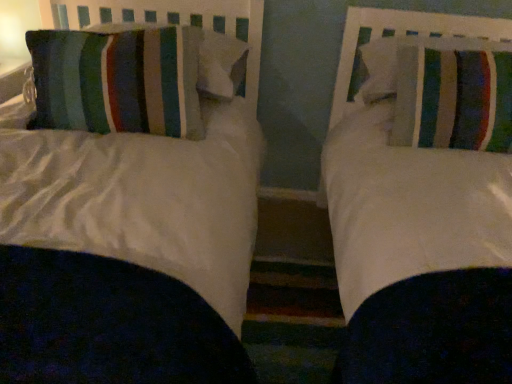
Question: From a real-world perspective, is striped fabric pillow at left, the fourth pillow when ordered from right to left, physically above striped fabric pillow at right, marked as the 4th pillow in a left-to-right arrangement?

Choices:
 (A) no
 (B) yes

Answer: (A)

Question: Is striped fabric pillow at left, the fourth pillow when ordered from right to left, further to the viewer compared to striped fabric pillow at right, which appears as the first pillow when viewed from the right?

Choices:
 (A) no
 (B) yes

Answer: (A)

Question: Is striped fabric pillow at left, the fourth pillow when ordered from right to left, to the left of striped fabric pillow at right, marked as the 4th pillow in a left-to-right arrangement, from the viewer's perspective?

Choices:
 (A) yes
 (B) no

Answer: (A)

Question: Is striped fabric pillow at left, acting as the 1th pillow starting from the left, closer to camera compared to striped fabric pillow at right, which appears as the first pillow when viewed from the right?

Choices:
 (A) no
 (B) yes

Answer: (B)

Question: Is the surface of striped fabric pillow at left, acting as the 1th pillow starting from the left, in direct contact with striped fabric pillow at right, marked as the 4th pillow in a left-to-right arrangement?

Choices:
 (A) no
 (B) yes

Answer: (A)

Question: Is striped fabric pillow at left, the fourth pillow when ordered from right to left, turned away from striped fabric pillow at right, marked as the 4th pillow in a left-to-right arrangement?

Choices:
 (A) yes
 (B) no

Answer: (B)

Question: Does striped fabric pillow at left, acting as the 3th pillow starting from the right, have a lesser width compared to striped fabric pillow at left, the fourth pillow when ordered from right to left?

Choices:
 (A) no
 (B) yes

Answer: (A)

Question: From a real-world perspective, is striped fabric pillow at left, the second pillow when ordered from left to right, beneath striped fabric pillow at left, acting as the 1th pillow starting from the left?

Choices:
 (A) yes
 (B) no

Answer: (B)

Question: From the image's perspective, does striped fabric pillow at left, acting as the 3th pillow starting from the right, appear lower than striped fabric pillow at left, the fourth pillow when ordered from right to left?

Choices:
 (A) yes
 (B) no

Answer: (B)

Question: Is striped fabric pillow at left, acting as the 3th pillow starting from the right, positioned behind striped fabric pillow at left, acting as the 1th pillow starting from the left?

Choices:
 (A) no
 (B) yes

Answer: (B)

Question: Does striped fabric pillow at left, the second pillow when ordered from left to right, have a larger size compared to striped fabric pillow at left, the fourth pillow when ordered from right to left?

Choices:
 (A) yes
 (B) no

Answer: (B)

Question: Is striped fabric pillow at left, the second pillow when ordered from left to right, aimed at striped fabric pillow at left, the fourth pillow when ordered from right to left?

Choices:
 (A) no
 (B) yes

Answer: (A)

Question: Is striped fabric pillow at right, the second pillow when ordered from right to left, at the back of striped fabric pillow at right, marked as the 4th pillow in a left-to-right arrangement?

Choices:
 (A) yes
 (B) no

Answer: (B)